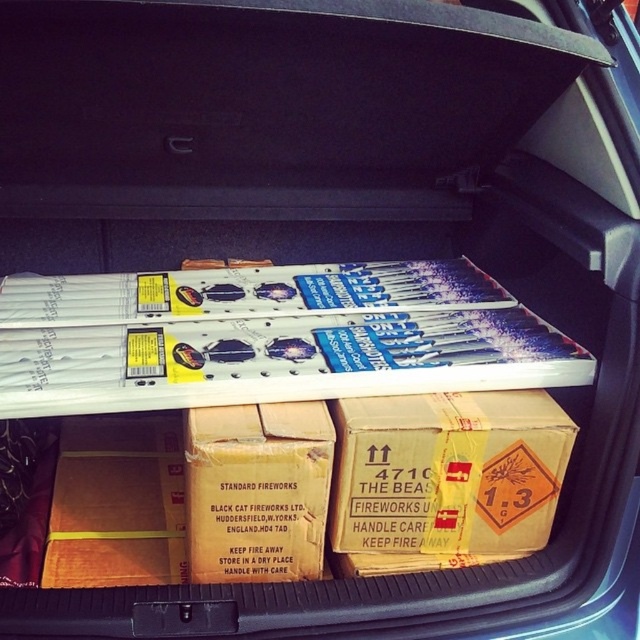
Does brown cardboard box at lower center appear under brown cardboard box at center?

Incorrect, brown cardboard box at lower center is not positioned below brown cardboard box at center.

In the scene shown: Is brown cardboard box at lower center to the right of brown cardboard box at center from the viewer's perspective?

Correct, you'll find brown cardboard box at lower center to the right of brown cardboard box at center.

Which is in front, point (385, 544) or point (244, 417)?

Point (244, 417) is more forward.

Find the location of `brown cardboard box at lower center`. brown cardboard box at lower center is located at coordinates [445, 477].

Is black cardboard box at center further to camera compared to brown cardboard box at center?

No, black cardboard box at center is in front of brown cardboard box at center.

Is black cardboard box at center closer to the viewer compared to brown cardboard box at center?

That is True.

What do you see at coordinates (266, 104) in the screenshot?
I see `black cardboard box at center` at bounding box center [266, 104].

This screenshot has height=640, width=640. What are the coordinates of `black cardboard box at center` in the screenshot? It's located at (266, 104).

Which is in front, point (432, 68) or point (433, 410)?

Point (433, 410) is in front.

Which of these two, black cardboard box at center or brown cardboard box at lower center, stands shorter?

With less height is black cardboard box at center.

Does point (248, 0) come behind point (381, 472)?

No, it is not.

Image resolution: width=640 pixels, height=640 pixels. Identify the location of black cardboard box at center. (266, 104).